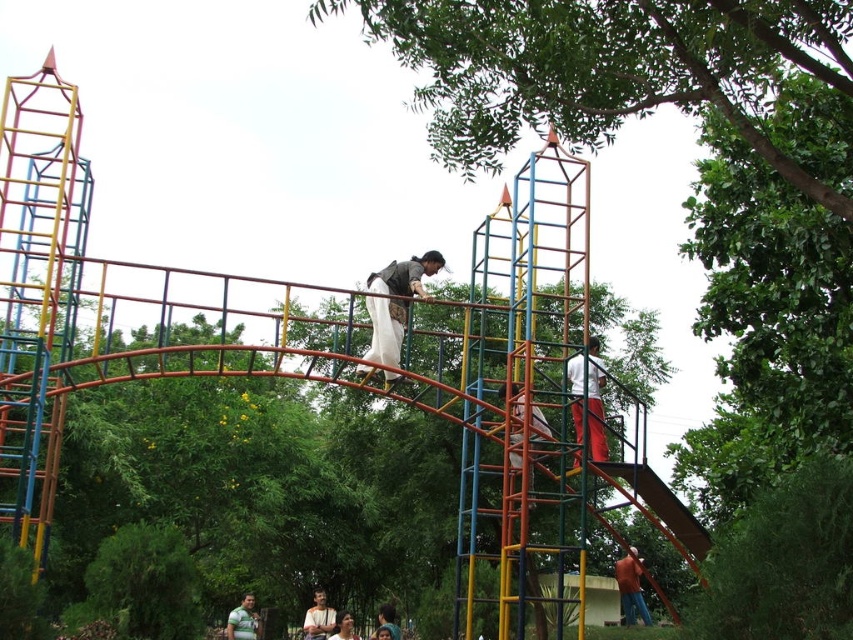
Question: Which point is farther from the camera taking this photo?

Choices:
 (A) (252, 593)
 (B) (381, 301)
 (C) (392, 624)
 (D) (619, 604)

Answer: (A)

Question: Is white cotton pants at center to the left of metallic silver helmet at upper center from the viewer's perspective?

Choices:
 (A) yes
 (B) no

Answer: (B)

Question: Which is farther from the green textured shirt at lower center?

Choices:
 (A) metallic silver helmet at upper center
 (B) smooth skin face at lower center

Answer: (A)

Question: In this image, where is matte brown vest at center located relative to white cotton pants at center?

Choices:
 (A) left
 (B) right

Answer: (A)

Question: Does white cotton pants at center have a lesser width compared to smooth brown shirt at center?

Choices:
 (A) no
 (B) yes

Answer: (B)

Question: Which object is the farthest from the white cotton pants at center?

Choices:
 (A) metallic silver helmet at upper center
 (B) smooth skin face at lower center
 (C) smooth brown hair at lower center

Answer: (B)